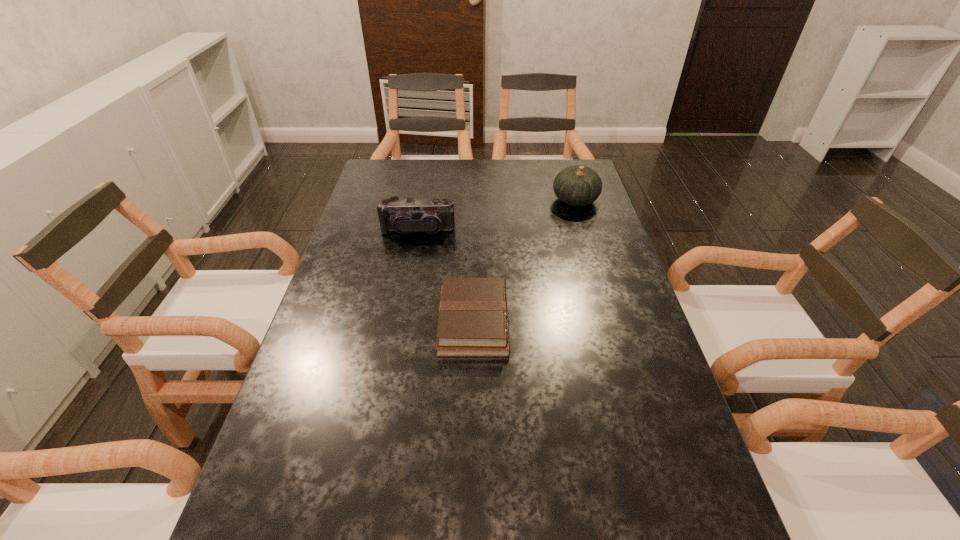
Where is `unoccupied position between the nearest object and the second shortest object`? This screenshot has height=540, width=960. unoccupied position between the nearest object and the second shortest object is located at coordinates (445, 276).

Identify which object is the closest to the camcorder. Please provide its 2D coordinates. Your answer should be formatted as a tuple, i.e. [(x, y)], where the tuple contains the x and y coordinates of a point satisfying the conditions above.

[(473, 321)]

Point out which object is positioned as the second nearest to the nearest object. Please provide its 2D coordinates. Your answer should be formatted as a tuple, i.e. [(x, y)], where the tuple contains the x and y coordinates of a point satisfying the conditions above.

[(577, 185)]

Locate an element on the screen. The width and height of the screenshot is (960, 540). vacant region that satisfies the following two spatial constraints: 1. on the front side of the gourd; 2. on the spine side of the Bible is located at coordinates (612, 322).